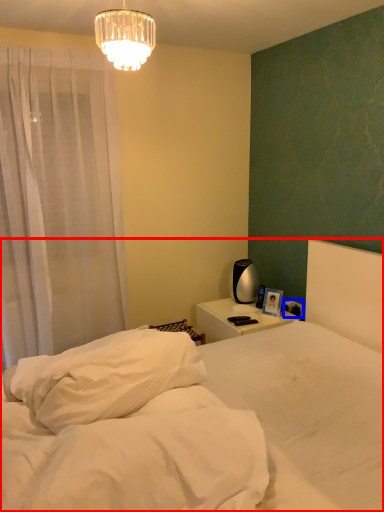
Question: Which object is closer to the camera taking this photo, bed (highlighted by a red box) or electric outlet (highlighted by a blue box)?

Choices:
 (A) bed
 (B) electric outlet

Answer: (A)